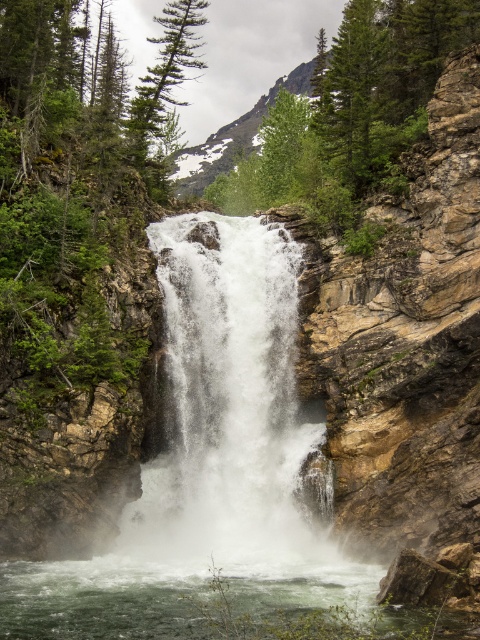
Is white frothy water at center to the left of green frothy water at lower center from the viewer's perspective?

Correct, you'll find white frothy water at center to the left of green frothy water at lower center.

Image resolution: width=480 pixels, height=640 pixels. In order to click on white frothy water at center in this screenshot , I will do `click(228, 410)`.

Find the location of `white frothy water at center`. white frothy water at center is located at coordinates (228, 410).